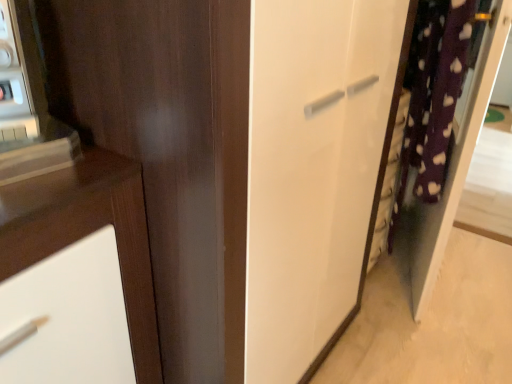
Where is `brushed metal oven at upper left`? The image size is (512, 384). brushed metal oven at upper left is located at coordinates (19, 80).

This screenshot has height=384, width=512. Describe the element at coordinates (19, 80) in the screenshot. I see `brushed metal oven at upper left` at that location.

Locate an element on the screen. brushed metal oven at upper left is located at coordinates (19, 80).